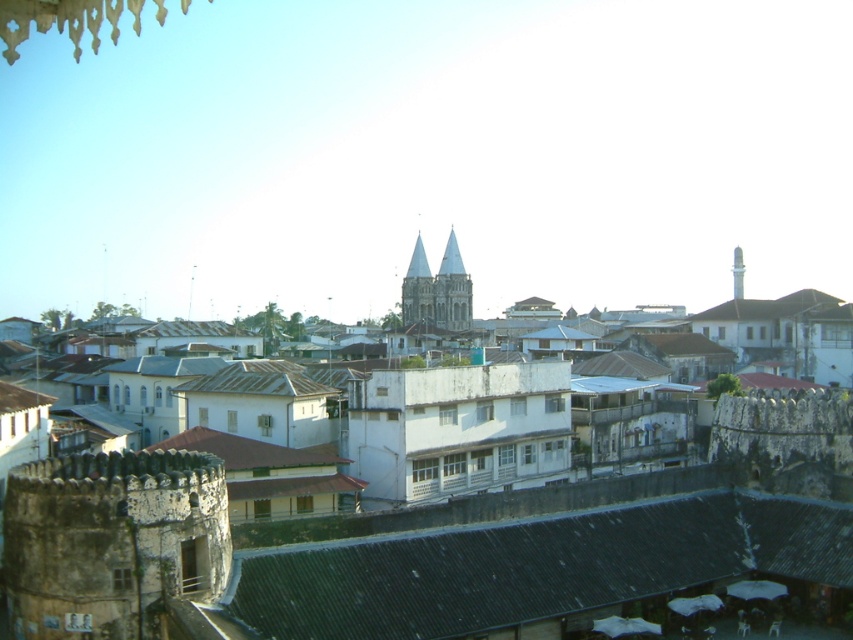
You are standing in the urban area shown in the image and want to determine the relative positions of two points. Which point is closer to you, point [408,296] or point [741,282]?

Point [408,296] is further to the viewer than point [741,282], so point [741,282] is closer to you.

You are standing at the point with coordinates (567, 573) in the urban area. What type of roof is directly beneath you?

The dark gray corrugated metal roof at center is located at point (567, 573), so the roof directly beneath you is the dark gray corrugated metal roof at center.